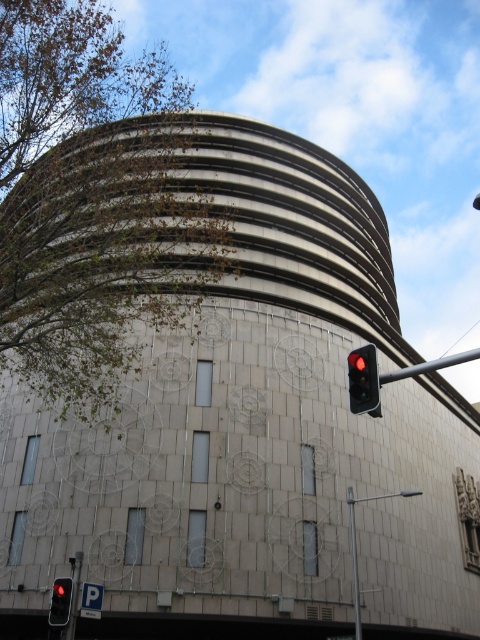
Question: Which point appears farthest from the camera in this image?

Choices:
 (A) (69, 609)
 (B) (427, 364)

Answer: (A)

Question: Which is nearer to the metallic pole at right?

Choices:
 (A) red plastic traffic light at right
 (B) red glass traffic light at lower left

Answer: (A)

Question: Does metallic pole at right have a lesser width compared to red glass traffic light at lower left?

Choices:
 (A) no
 (B) yes

Answer: (A)

Question: Which of these objects is positioned farthest from the red glass traffic light at lower left?

Choices:
 (A) red plastic traffic light at right
 (B) metallic pole at right

Answer: (B)

Question: Does metallic pole at right have a larger size compared to red glass traffic light at lower left?

Choices:
 (A) yes
 (B) no

Answer: (A)

Question: Can you confirm if red plastic traffic light at right is positioned below metallic pole at right?

Choices:
 (A) yes
 (B) no

Answer: (B)